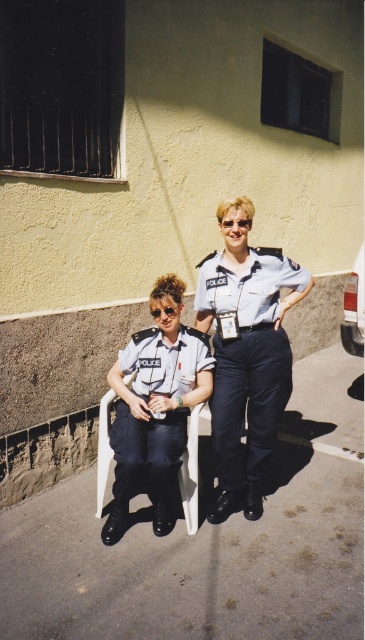
You are taking a photo of the two points marked in the scene. Which point, point [286,340] or point [137,374], will appear larger in the photo?

Point [286,340] is closer to the camera than point [137,374], so it will appear larger in the photo.

You are standing in front of the building and see the point at coordinates [247,358]. What object does this point correspond to?

The point at coordinates [247,358] corresponds to the light blue fabric uniform at center.

You are a photographer trying to capture both the light blue fabric uniform at center and the matte white uniform at center in a single shot. Since you want to ensure both are visible, which uniform should you position closer to the camera to avoid one being hidden by the other?

The light blue fabric uniform at center is to the right of matte white uniform at center. To avoid one being hidden, position the matte white uniform at center closer to the camera since it is on the left side and might be farther away if the light blue one is to its right.